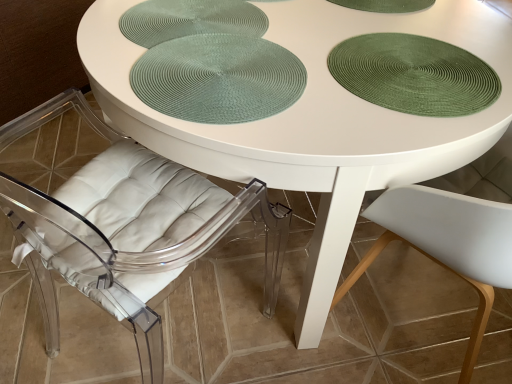
The image size is (512, 384). Identify the location of empty space that is ontop of green textured placemat at upper right, which is the 1th glass plate in right-to-left order (from a real-world perspective). (406, 85).